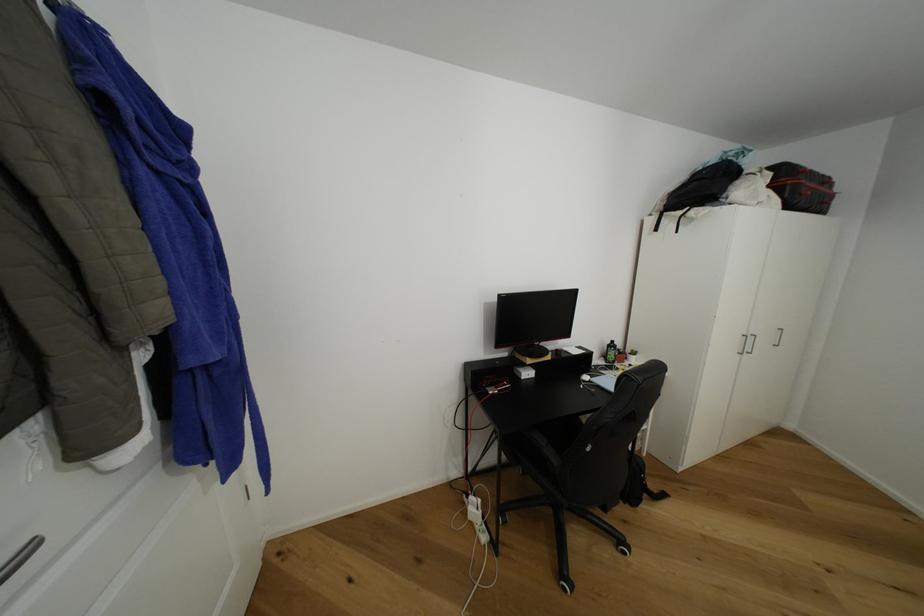
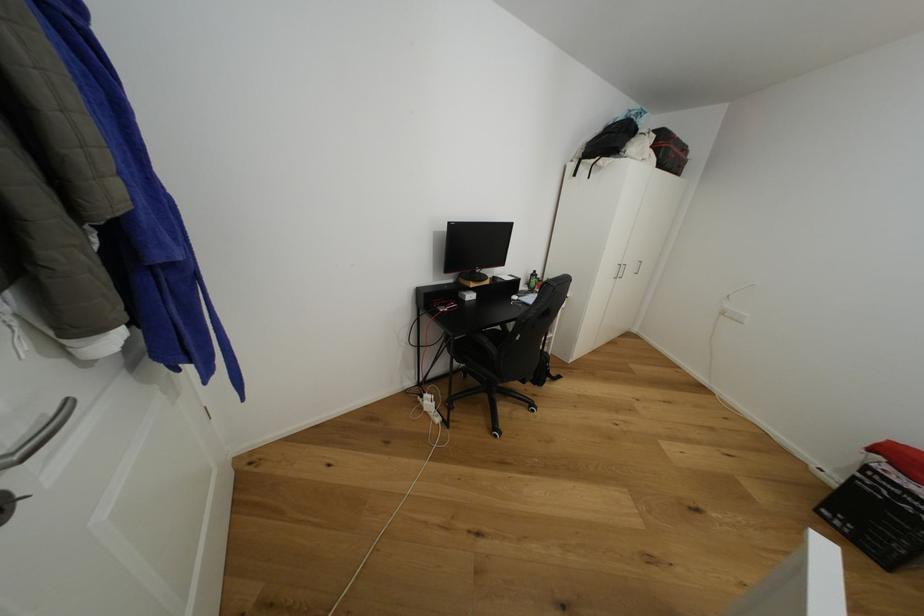
Question: The camera is either moving clockwise (left) or counter-clockwise (right) around the object. The first image is from the beginning of the video and the second image is from the end. Is the camera moving left or right when shooting the video?

Choices:
 (A) Left
 (B) Right

Answer: (A)